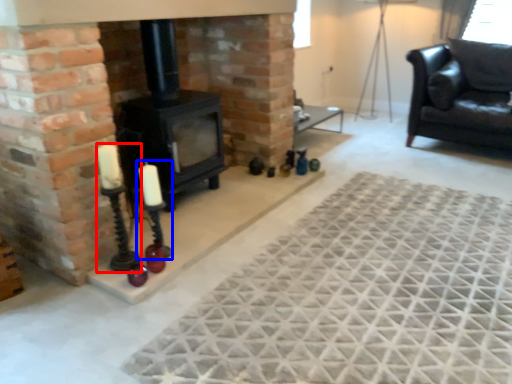
Question: Among these objects, which one is nearest to the camera, candle holder (highlighted by a red box) or candle holder (highlighted by a blue box)?

Choices:
 (A) candle holder
 (B) candle holder

Answer: (A)